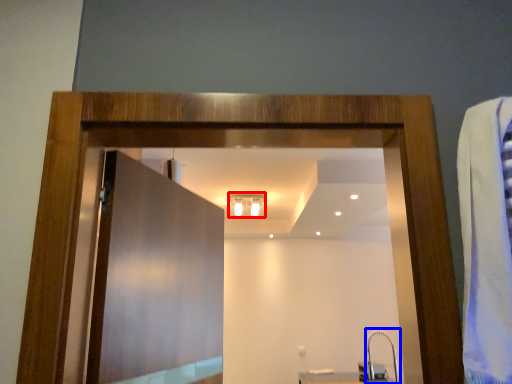
Question: Which point is closer to the camera, light fixture (highlighted by a red box) or faucet (highlighted by a blue box)?

Choices:
 (A) light fixture
 (B) faucet

Answer: (B)